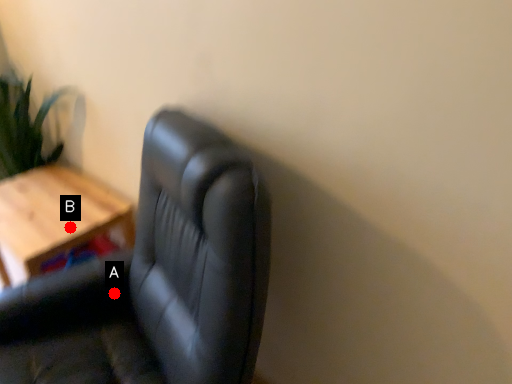
Question: Two points are circled on the image, labeled by A and B beside each circle. Which of the following is the farthest from the observer?

Choices:
 (A) A is further
 (B) B is further

Answer: (B)